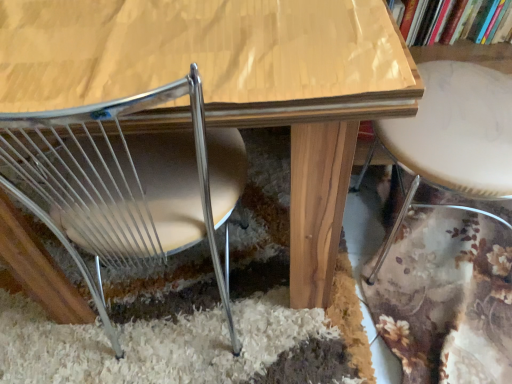
Question: Is white marble bar stool at right located outside hardcover book at upper right?

Choices:
 (A) no
 (B) yes

Answer: (B)

Question: Is white marble bar stool at right turned away from hardcover book at upper right?

Choices:
 (A) yes
 (B) no

Answer: (B)

Question: Could hardcover book at upper right be considered to be inside white marble bar stool at right?

Choices:
 (A) yes
 (B) no

Answer: (B)

Question: Is white marble bar stool at right smaller than hardcover book at upper right?

Choices:
 (A) yes
 (B) no

Answer: (B)

Question: From a real-world perspective, is white marble bar stool at right located higher than hardcover book at upper right?

Choices:
 (A) no
 (B) yes

Answer: (A)

Question: From a real-world perspective, relative to white marble bar stool at right, is metallic wire chair at lower left vertically above or below?

Choices:
 (A) below
 (B) above

Answer: (B)

Question: Would you say metallic wire chair at lower left is to the left or to the right of white marble bar stool at right in the picture?

Choices:
 (A) left
 (B) right

Answer: (A)

Question: Considering their positions, is metallic wire chair at lower left located in front of or behind white marble bar stool at right?

Choices:
 (A) behind
 (B) front

Answer: (B)

Question: From the image's perspective, is metallic wire chair at lower left above or below white marble bar stool at right?

Choices:
 (A) below
 (B) above

Answer: (A)

Question: From a real-world perspective, relative to metallic wire chair at lower left, is wooden table at center vertically above or below?

Choices:
 (A) below
 (B) above

Answer: (A)

Question: Considering the positions of wooden table at center and metallic wire chair at lower left in the image, is wooden table at center taller or shorter than metallic wire chair at lower left?

Choices:
 (A) tall
 (B) short

Answer: (B)

Question: Choose the correct answer: Is wooden table at center inside metallic wire chair at lower left or outside it?

Choices:
 (A) outside
 (B) inside

Answer: (A)

Question: Does point click(372, 41) appear closer or farther from the camera than point click(45, 187)?

Choices:
 (A) farther
 (B) closer

Answer: (B)

Question: Is white marble bar stool at right wider or thinner than hardcover book at upper right?

Choices:
 (A) thin
 (B) wide

Answer: (B)

Question: Considering the positions of white marble bar stool at right and hardcover book at upper right in the image, is white marble bar stool at right bigger or smaller than hardcover book at upper right?

Choices:
 (A) big
 (B) small

Answer: (A)